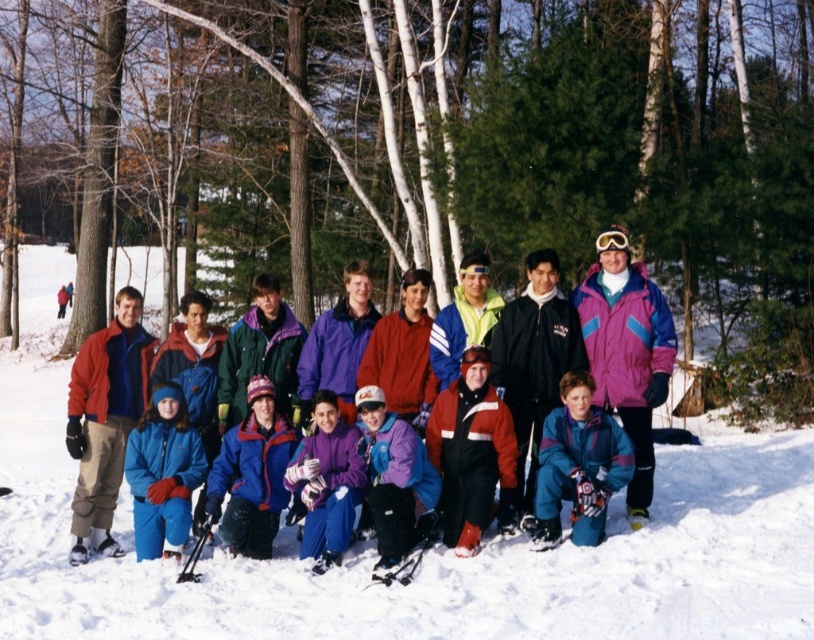
Between white fluffy snow at center and matte purple ski jacket at center, which one appears on the right side from the viewer's perspective?

From the viewer's perspective, matte purple ski jacket at center appears more on the right side.

Which is more to the left, white fluffy snow at center or matte purple ski jacket at center?

From the viewer's perspective, white fluffy snow at center appears more on the left side.

Who is more distant from viewer, (755, 506) or (593, 344)?

The point (593, 344) is more distant.

Locate an element on the screen. The height and width of the screenshot is (640, 814). white fluffy snow at center is located at coordinates (425, 556).

How distant is white fluffy snow at center from matte red jacket at center?

white fluffy snow at center and matte red jacket at center are 20.21 feet apart from each other.

Does white fluffy snow at center have a lesser height compared to matte red jacket at center?

No, white fluffy snow at center is not shorter than matte red jacket at center.

Does point (677, 492) come behind point (81, 348)?

That is True.

You are a GUI agent. You are given a task and a screenshot of the screen. Output one action in this format:
    pyautogui.click(x=<x>, y=<y>)
    Task: Click on the white fluffy snow at center
    The height and width of the screenshot is (640, 814).
    Given the screenshot: What is the action you would take?
    pyautogui.click(x=425, y=556)

Who is positioned more to the right, white fluffy snow at center or blue fleece jacket at lower left?

Positioned to the right is blue fleece jacket at lower left.

The image size is (814, 640). Describe the element at coordinates (425, 556) in the screenshot. I see `white fluffy snow at center` at that location.

Locate an element on the screen. white fluffy snow at center is located at coordinates (425, 556).